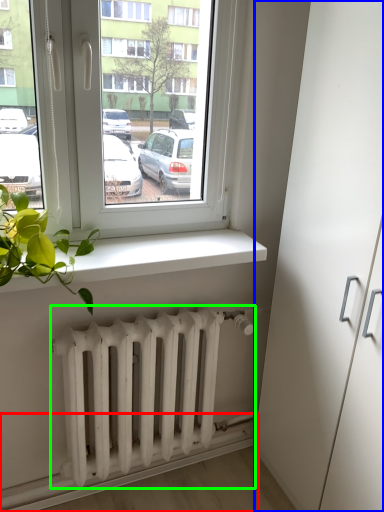
Question: Considering the real-world distances, which object is farthest from ledge (highlighted by a red box)? glass door (highlighted by a blue box) or radiator (highlighted by a green box)?

Choices:
 (A) glass door
 (B) radiator

Answer: (A)